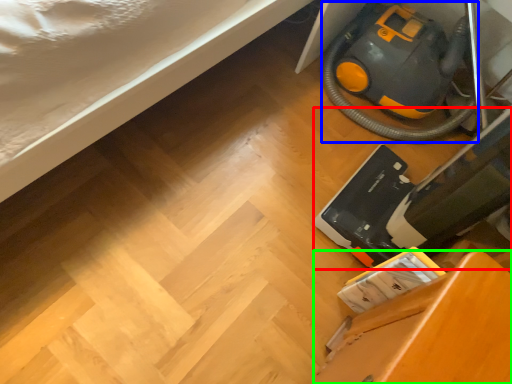
Question: Which object is the closest to the equipment (highlighted by a red box)? Choose among these: equipment (highlighted by a blue box) or furniture (highlighted by a green box).

Choices:
 (A) equipment
 (B) furniture

Answer: (B)